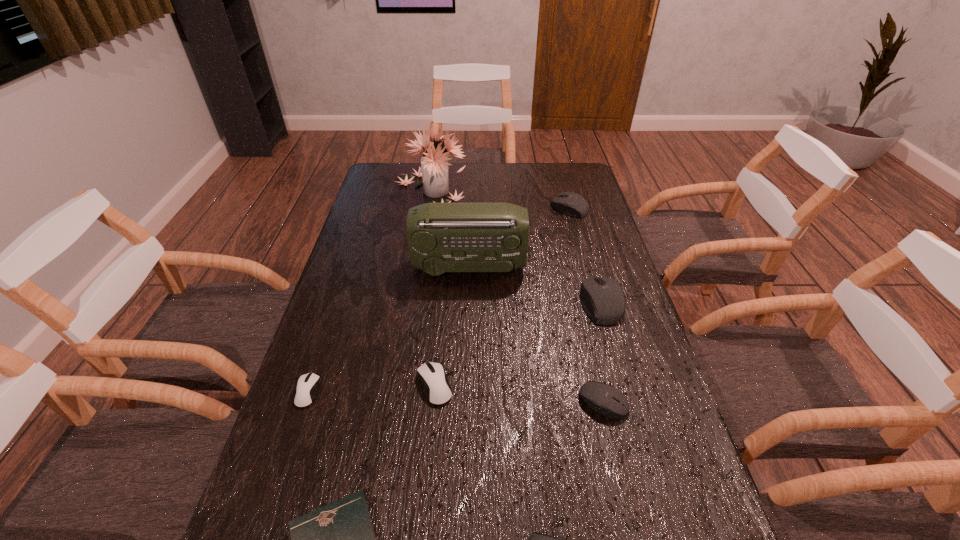
Select which object appears as the seventh closest to the bigger white mouse. Please provide its 2D coordinates. Your answer should be formatted as a tuple, i.e. [(x, y)], where the tuple contains the x and y coordinates of a point satisfying the conditions above.

[(434, 166)]

Identify which object is the fifth nearest to the third computer equipment from left to right. Please provide its 2D coordinates. Your answer should be formatted as a tuple, i.e. [(x, y)], where the tuple contains the x and y coordinates of a point satisfying the conditions above.

[(307, 386)]

Locate which computer equipment is the second closest to the nearest computer equipment. Please provide its 2D coordinates. Your answer should be formatted as a tuple, i.e. [(x, y)], where the tuple contains the x and y coordinates of a point satisfying the conditions above.

[(437, 389)]

This screenshot has height=540, width=960. I want to click on the fourth closest computer equipment to the farthest black computer equipment, so click(307, 386).

Locate which black computer equipment ranks fourth in proximity to the leftmost object. Please provide its 2D coordinates. Your answer should be formatted as a tuple, i.e. [(x, y)], where the tuple contains the x and y coordinates of a point satisfying the conditions above.

[(569, 203)]

Identify the location of black computer equipment that is the second nearest to the book. The image size is (960, 540). coord(608,401).